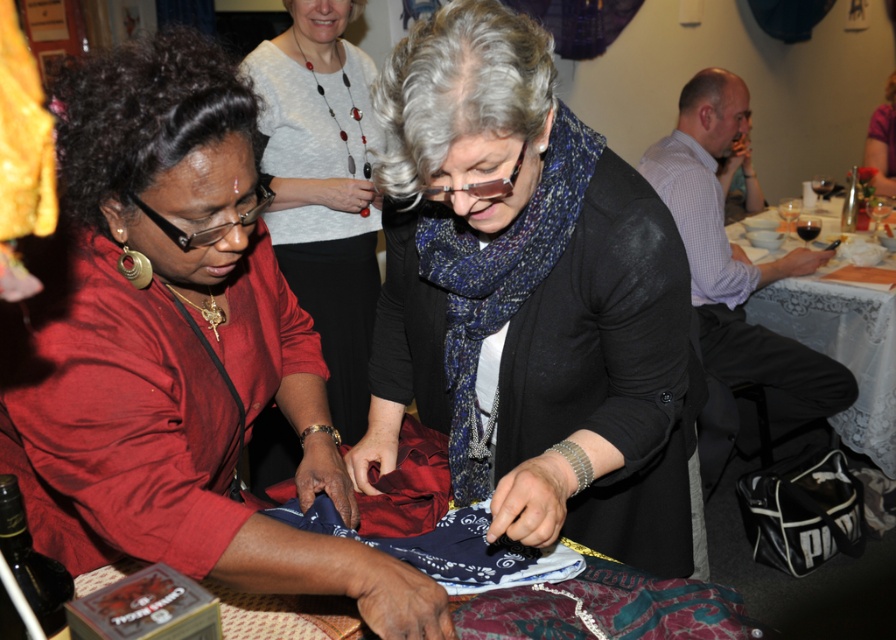
Question: Is dark brown glass wine bottle at lower left thinner than purple fabric at upper right?

Choices:
 (A) yes
 (B) no

Answer: (A)

Question: Can you confirm if blue knitted scarf at center is smaller than purple fabric at upper right?

Choices:
 (A) no
 (B) yes

Answer: (B)

Question: Which of these objects is positioned closest to the blue printed fabric at lower left?

Choices:
 (A) matte black sweater at center
 (B) purple fabric at upper right
 (C) matte red blouse at center
 (D) white lace tablecloth at right

Answer: (C)

Question: Can you confirm if matte red blouse at center is wider than white lace tablecloth at right?

Choices:
 (A) yes
 (B) no

Answer: (B)

Question: Which object is farther from the camera taking this photo?

Choices:
 (A) white lace tablecloth at right
 (B) dark red glass at center

Answer: (B)

Question: Which object is the closest to the matte red blouse at center?

Choices:
 (A) blue printed fabric at lower left
 (B) matte blue scarf at center
 (C) blue knitted scarf at center
 (D) dark red glass at center

Answer: (A)